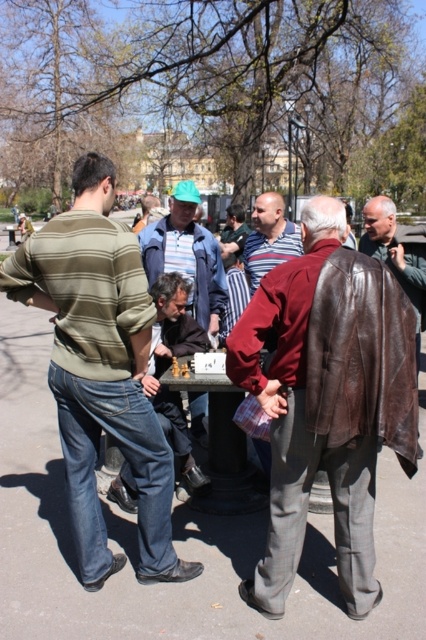
Question: Does wooden chessboard at center have a larger size compared to striped cotton shirt at center?

Choices:
 (A) yes
 (B) no

Answer: (A)

Question: Does brown leather jacket at center lie behind brown leather jacket at right?

Choices:
 (A) yes
 (B) no

Answer: (A)

Question: Which point is closer to the camera?

Choices:
 (A) (161, 406)
 (B) (235, 252)

Answer: (A)

Question: Observing the image, what is the correct spatial positioning of striped cotton shirt at left in reference to brown leather jacket at right?

Choices:
 (A) right
 (B) left

Answer: (B)

Question: Which object appears closest to the camera in this image?

Choices:
 (A) brown leather jacket at right
 (B) striped cotton shirt at left
 (C) brown leather jacket at center

Answer: (A)

Question: Which point appears farthest from the camera in this image?

Choices:
 (A) (273, 221)
 (B) (284, 276)
 (C) (181, 355)

Answer: (A)